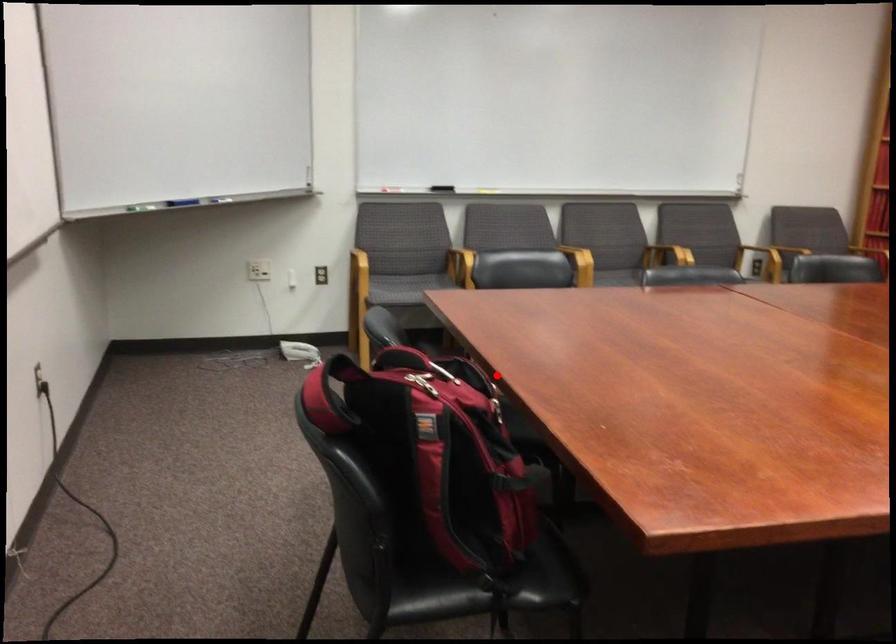
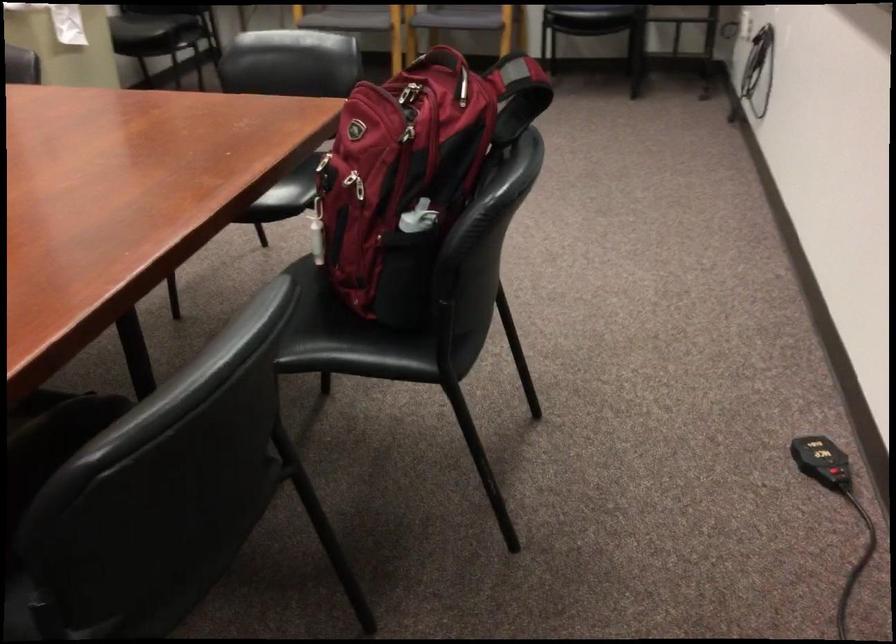
Find the pixel in the second image that matches the highlighted location in the first image.

(412, 136)